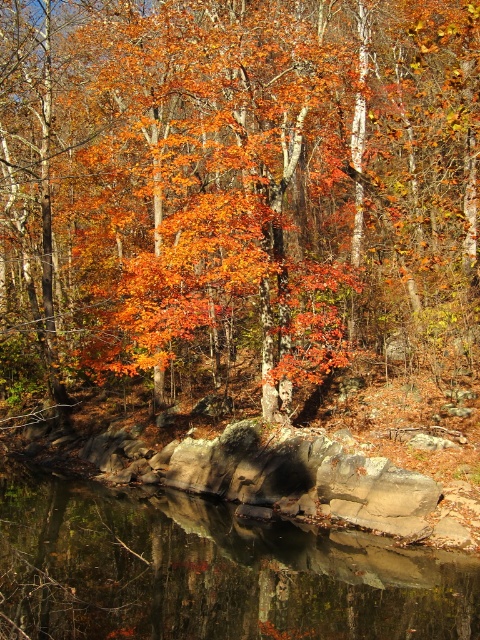
Is orange leafy tree at center wider than smooth reflective water at center?

Correct, the width of orange leafy tree at center exceeds that of smooth reflective water at center.

Between orange leafy tree at center and smooth reflective water at center, which one has more height?

orange leafy tree at center

Is point (47, 12) positioned after point (180, 516)?

Yes, it is.

What are the coordinates of `orange leafy tree at center` in the screenshot? It's located at (230, 182).